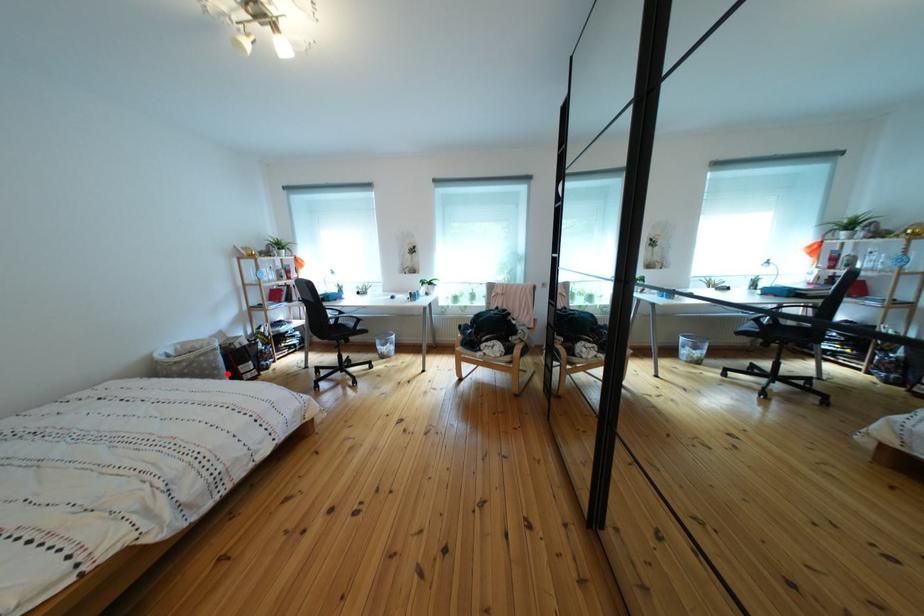
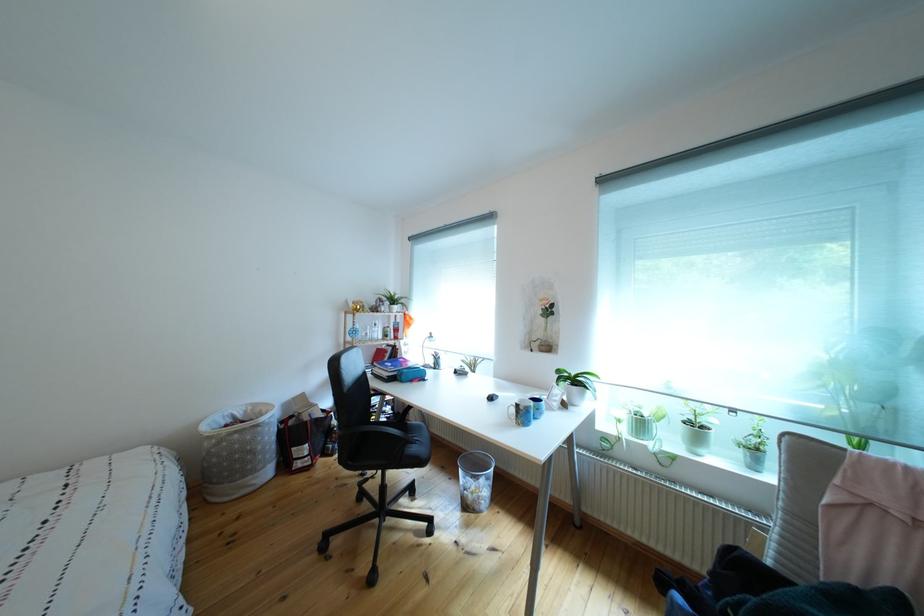
Question: I am providing you with two images of the same scene from different viewpoints. Given a red point in image1, look at the same physical point in image2. Is it:

Choices:
 (A) Closer to the viewpoint
 (B) Farther from the viewpoint

Answer: (B)